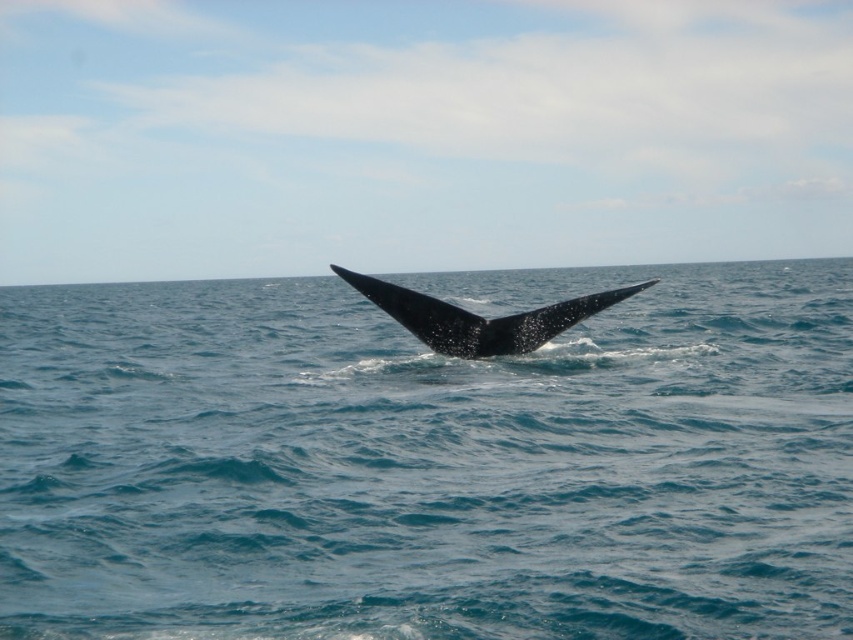
You are a marine biologist observing this underwater scene. You notice the glossy blue water at center and the black matte whale tail at center. Which object takes up more space in the image?

The glossy blue water at center is bigger than the black matte whale tail at center, so the glossy blue water at center takes up more space in the image.

You are a marine biologist observing the ocean surface. You notice the glossy blue water at center and the black matte whale tail at center. Which object is positioned to the left of the other?

The glossy blue water at center is to the left of the black matte whale tail at center.